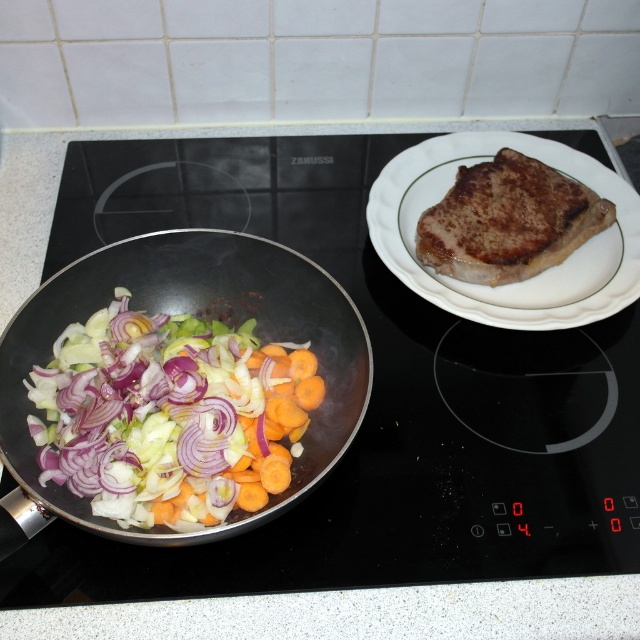
Image resolution: width=640 pixels, height=640 pixels. I want to click on black matte wok at left, so [202, 317].

Does black matte wok at left appear under white ceramic plate at upper right?

Yes.

Between point (257, 326) and point (637, 269), which one is positioned behind?

The point (637, 269) is behind.

Identify the location of black matte wok at left. (202, 317).